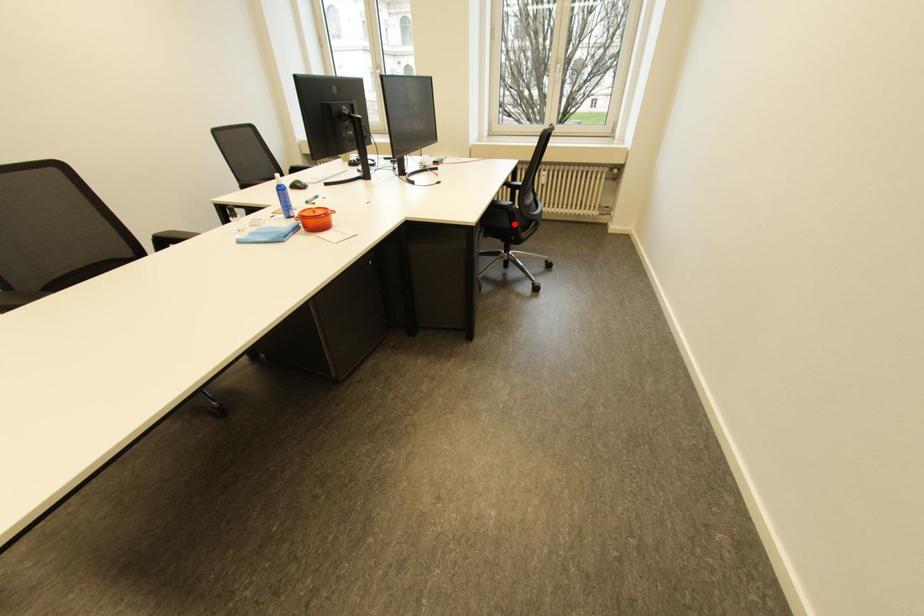
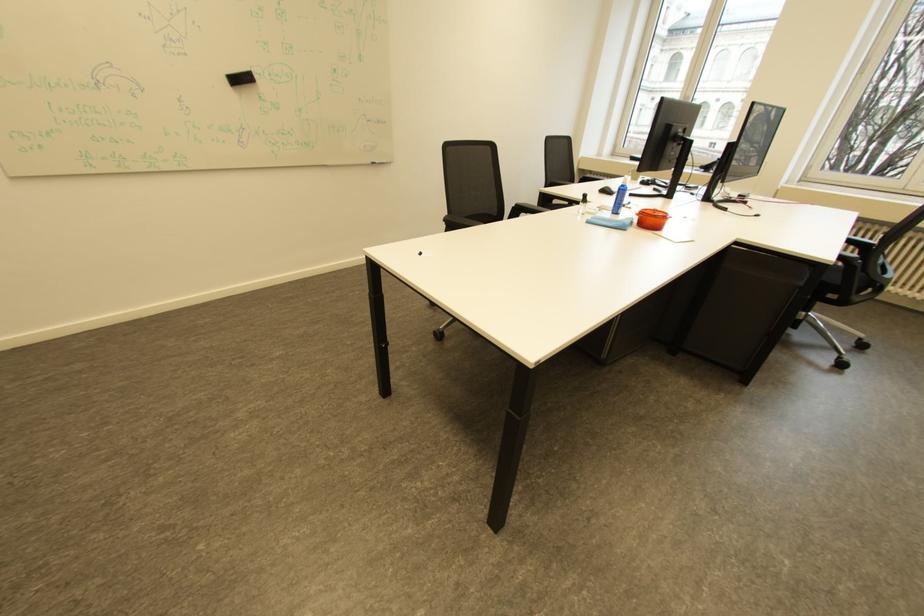
In the second image, find the point that corresponds to the highlighted location in the first image.

(845, 278)